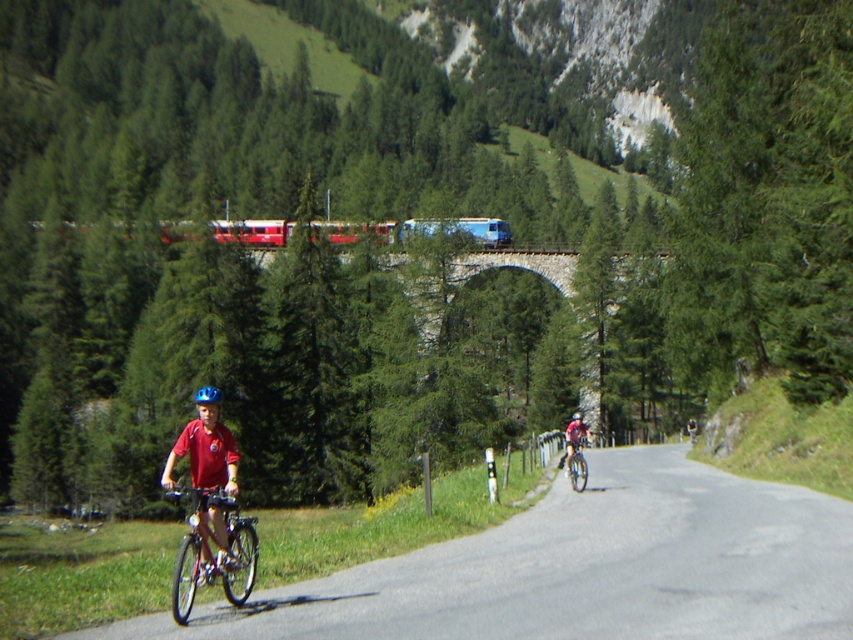
Is smooth asphalt road at center to the right of shiny metallic bicycle at center from the viewer's perspective?

Yes, smooth asphalt road at center is to the right of shiny metallic bicycle at center.

Can you confirm if smooth asphalt road at center is shorter than shiny metallic bicycle at center?

No.

What are the coordinates of `smooth asphalt road at center` in the screenshot? It's located at (581, 568).

Does point (505, 237) come behind point (207, 387)?

Yes.

In the scene shown: Who is more forward, (253,228) or (206,397)?

Positioned in front is point (206,397).

What are the coordinates of `red matte train at center` in the screenshot? It's located at (415, 228).

From the picture: Can you confirm if red matte train at center is taller than shiny metallic bicycle at center?

Correct, red matte train at center is much taller as shiny metallic bicycle at center.

The width and height of the screenshot is (853, 640). What do you see at coordinates (415, 228) in the screenshot?
I see `red matte train at center` at bounding box center [415, 228].

The width and height of the screenshot is (853, 640). Describe the element at coordinates (415, 228) in the screenshot. I see `red matte train at center` at that location.

I want to click on red matte train at center, so click(415, 228).